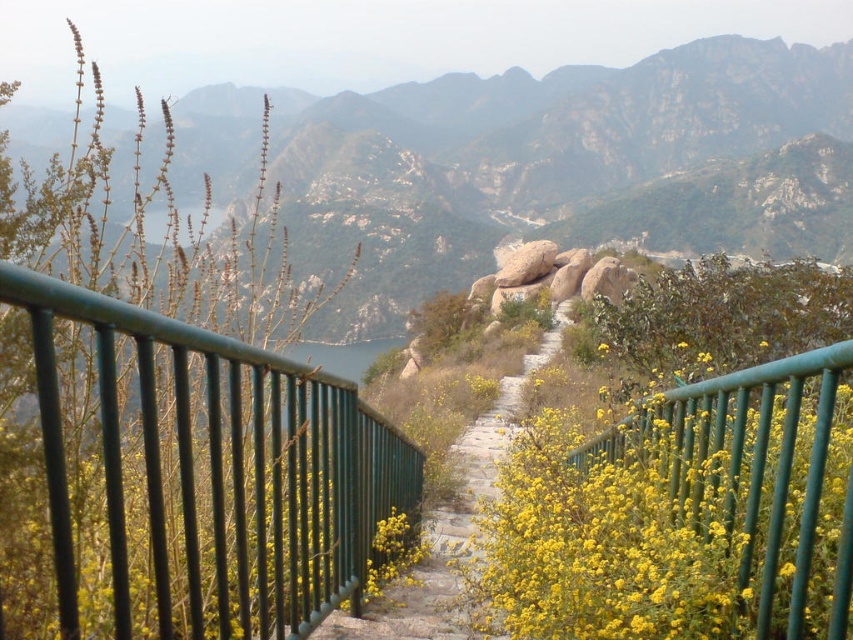
You are a hiker standing on the pathway and want to take a photo of the yellow matte flowers at center and the green metal railing at center. Which object should you focus on first if you want to capture both in the same frame without moving your camera?

The yellow matte flowers at center is located above the green metal railing at center, so you should focus on the yellow matte flowers at center first to ensure both are in frame.

You are a hiker planning to walk along the stone paved path at center. There is a green metal railing at center nearby. Which direction should you walk to stay safe and follow the path?

The green metal railing at center is positioned over the stone paved path at center, so you should walk along the path while keeping the green metal railing at center on your left to stay safe and follow the trail.